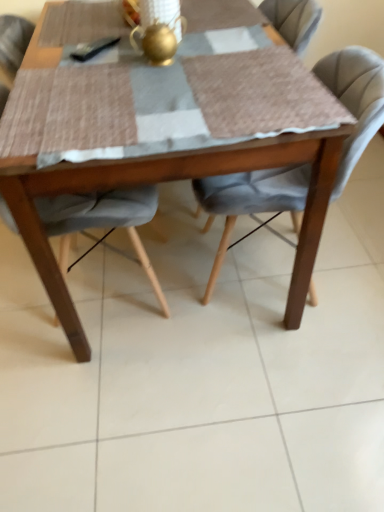
Question: From the image's perspective, is velvet grey chair at center, positioned as the second chair in left-to-right order, located beneath gold metallic teapot at center?

Choices:
 (A) no
 (B) yes

Answer: (B)

Question: Is velvet grey chair at center, positioned as the first chair in right-to-left order, taller than gold metallic teapot at center?

Choices:
 (A) no
 (B) yes

Answer: (B)

Question: Considering the relative positions of velvet grey chair at center, positioned as the first chair in right-to-left order, and gold metallic teapot at center in the image provided, is velvet grey chair at center, positioned as the first chair in right-to-left order, behind gold metallic teapot at center?

Choices:
 (A) no
 (B) yes

Answer: (A)

Question: From a real-world perspective, is velvet grey chair at center, positioned as the first chair in right-to-left order, located beneath gold metallic teapot at center?

Choices:
 (A) no
 (B) yes

Answer: (B)

Question: Considering the relative sizes of velvet grey chair at center, positioned as the second chair in left-to-right order, and gold metallic teapot at center in the image provided, is velvet grey chair at center, positioned as the second chair in left-to-right order, smaller than gold metallic teapot at center?

Choices:
 (A) no
 (B) yes

Answer: (A)

Question: From a real-world perspective, relative to velvet grey chair at center, positioned as the first chair in right-to-left order, is wooden table at center vertically above or below?

Choices:
 (A) above
 (B) below

Answer: (A)

Question: Considering their positions, is wooden table at center located in front of or behind velvet grey chair at center, positioned as the second chair in left-to-right order?

Choices:
 (A) front
 (B) behind

Answer: (A)

Question: From the image's perspective, is wooden table at center positioned above or below velvet grey chair at center, positioned as the first chair in right-to-left order?

Choices:
 (A) below
 (B) above

Answer: (B)

Question: Is wooden table at center to the left or to the right of velvet grey chair at center, positioned as the second chair in left-to-right order, in the image?

Choices:
 (A) right
 (B) left

Answer: (B)

Question: Is velvet grey chair at center, marked as the first chair in a left-to-right arrangement, wider or thinner than velvet grey chair at center, positioned as the second chair in left-to-right order?

Choices:
 (A) wide
 (B) thin

Answer: (B)

Question: Is velvet grey chair at center, which ranks as the second chair in right-to-left order, taller or shorter than velvet grey chair at center, positioned as the first chair in right-to-left order?

Choices:
 (A) tall
 (B) short

Answer: (A)

Question: Based on their positions, is velvet grey chair at center, marked as the first chair in a left-to-right arrangement, located to the left or right of velvet grey chair at center, positioned as the second chair in left-to-right order?

Choices:
 (A) left
 (B) right

Answer: (A)

Question: Based on their sizes in the image, would you say velvet grey chair at center, marked as the first chair in a left-to-right arrangement, is bigger or smaller than velvet grey chair at center, positioned as the second chair in left-to-right order?

Choices:
 (A) big
 (B) small

Answer: (A)

Question: Relative to velvet grey chair at center, positioned as the second chair in left-to-right order, is gold metallic teapot at center in front or behind?

Choices:
 (A) front
 (B) behind

Answer: (B)

Question: From their relative heights in the image, would you say gold metallic teapot at center is taller or shorter than velvet grey chair at center, positioned as the second chair in left-to-right order?

Choices:
 (A) short
 (B) tall

Answer: (A)